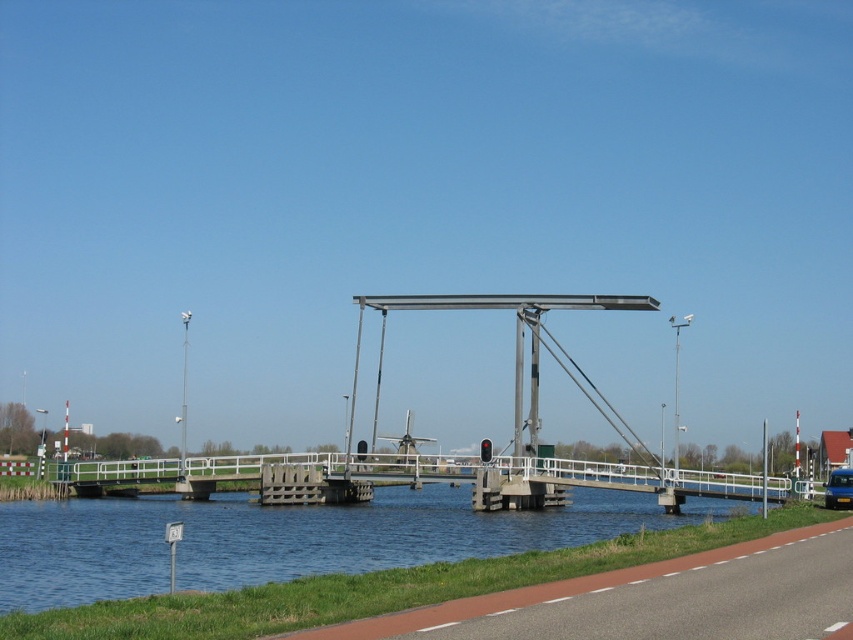
I want to click on blue water at lower left, so click(x=287, y=538).

Does blue water at lower left have a lesser height compared to blue metallic van at center?

No, blue water at lower left is not shorter than blue metallic van at center.

Locate an element on the screen. blue water at lower left is located at coordinates (287, 538).